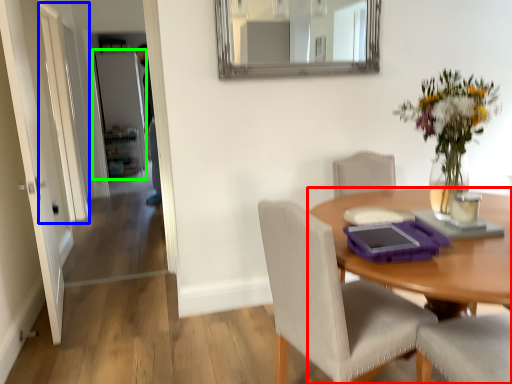
Question: Which object is positioned closest to desk (highlighted by a red box)? Select from glass door (highlighted by a blue box) and door (highlighted by a green box).

Choices:
 (A) glass door
 (B) door

Answer: (A)